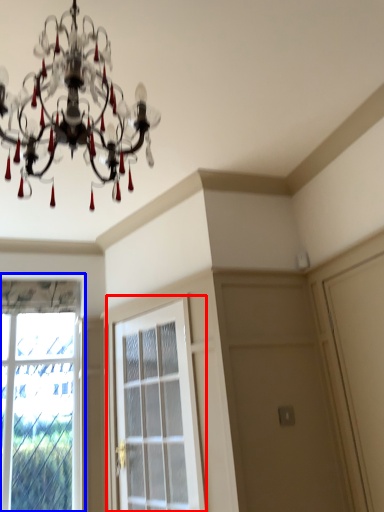
Question: Which point is closer to the camera, screen door (highlighted by a red box) or window (highlighted by a blue box)?

Choices:
 (A) screen door
 (B) window

Answer: (A)